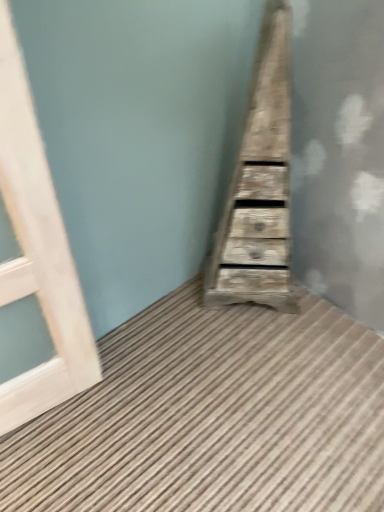
Locate an element on the screen. free space in front of distressed wood dresser at center is located at coordinates (257, 353).